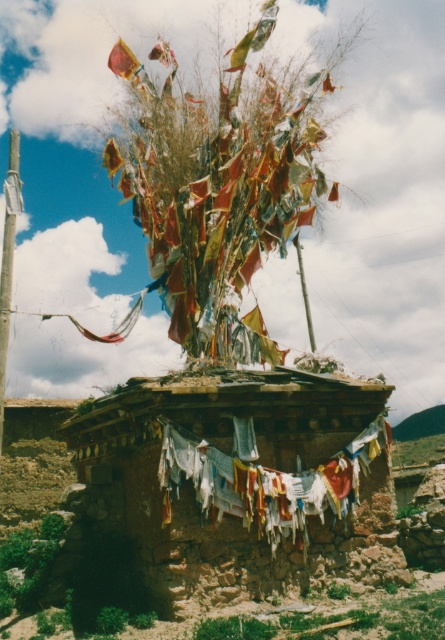
Question: Which of the following is the farthest from the observer?

Choices:
 (A) smooth concrete pole at left
 (B) worn fabric clothesline at center
 (C) brown textured hut at center

Answer: (C)

Question: Which of these objects is positioned farthest from the smooth concrete pole at left?

Choices:
 (A) worn fabric clothesline at center
 (B) brown textured hut at center

Answer: (B)

Question: Is worn fabric clothesline at center to the right of smooth concrete pole at left from the viewer's perspective?

Choices:
 (A) yes
 (B) no

Answer: (A)

Question: Among these points, which one is nearest to the camera?

Choices:
 (A) (199, 557)
 (B) (4, 256)
 (C) (258, 465)

Answer: (A)

Question: Does worn fabric clothesline at center appear on the right side of smooth concrete pole at left?

Choices:
 (A) no
 (B) yes

Answer: (B)

Question: Can you confirm if worn fabric clothesline at center is smaller than smooth concrete pole at left?

Choices:
 (A) no
 (B) yes

Answer: (B)